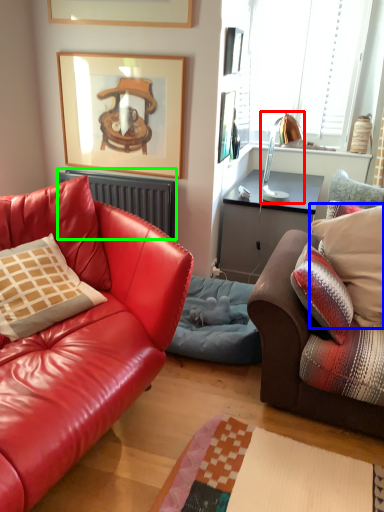
Question: Considering the real-world distances, which object is farthest from lamp (highlighted by a red box)? pillow (highlighted by a blue box) or radiator (highlighted by a green box)?

Choices:
 (A) pillow
 (B) radiator

Answer: (A)